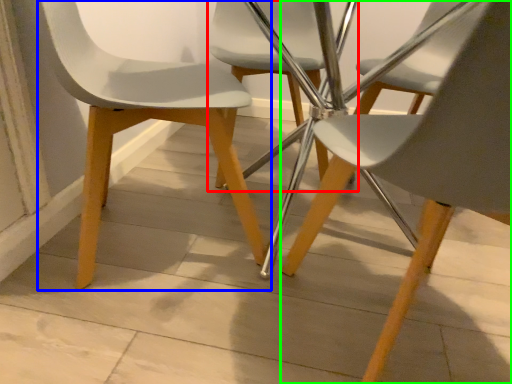
Question: Which is nearer to the chair (highlighted by a red box)? chair (highlighted by a blue box) or chair (highlighted by a green box).

Choices:
 (A) chair
 (B) chair

Answer: (A)